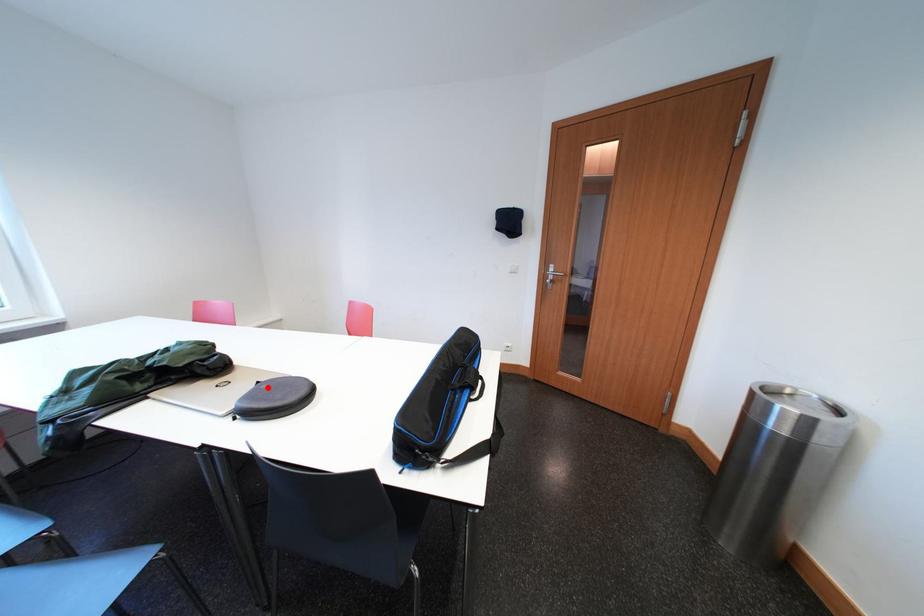
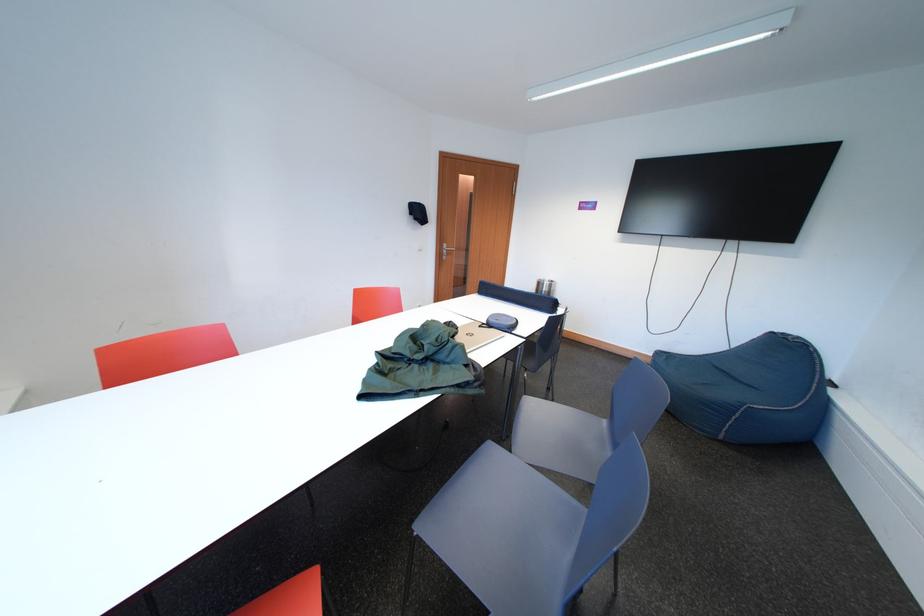
Locate, in the second image, the point that corresponds to the highlighted location in the first image.

(490, 330)